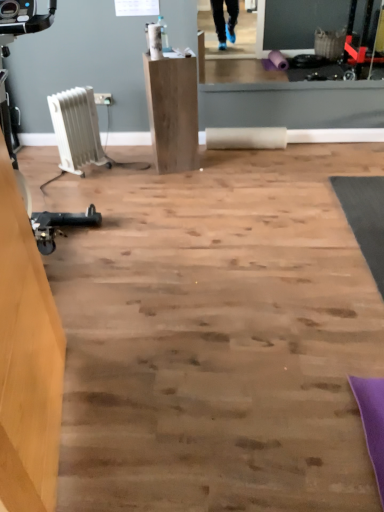
I want to click on free spot to the left of natural wood pedestal at center, arranged as the second furniture when viewed from the left, so click(136, 170).